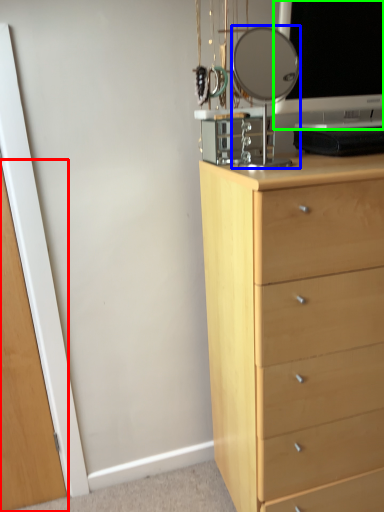
Question: Which object is the closest to the glass door (highlighted by a red box)? Choose among these: mirror (highlighted by a blue box) or computer monitor (highlighted by a green box).

Choices:
 (A) mirror
 (B) computer monitor

Answer: (B)